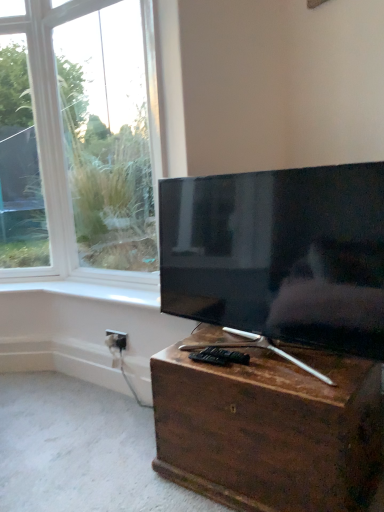
Question: Is brown wooden chest at lower center inside the boundaries of white plastic electric outlet at lower center, or outside?

Choices:
 (A) inside
 (B) outside

Answer: (B)

Question: Based on their sizes in the image, would you say brown wooden chest at lower center is bigger or smaller than white plastic electric outlet at lower center?

Choices:
 (A) big
 (B) small

Answer: (A)

Question: Which object is the closest to the white glossy window sill at upper center?

Choices:
 (A) white plastic electric outlet at lower center
 (B) brown wooden chest at lower center
 (C) matte black tv at center

Answer: (A)

Question: Estimate the real-world distances between objects in this image. Which object is closer to the matte black tv at center?

Choices:
 (A) brown wooden chest at lower center
 (B) white glossy window sill at upper center
 (C) white plastic electric outlet at lower center

Answer: (A)